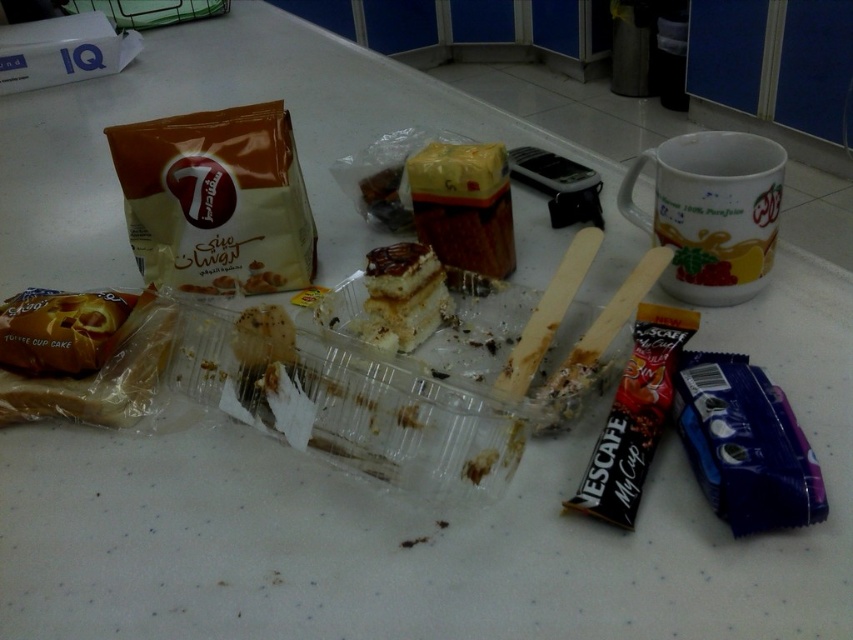
You are a chef trying to place the spongy yellow cake at center into the yellow plastic container at center. Can you fit the cake into the container without moving any other items on the table?

The yellow plastic container at center and spongy yellow cake at center are 3.39 inches apart, so there is enough space between them to fit the cake into the container without moving other items.

You are organizing items on the table and need to place a new item at the exact center of the table. The matte plastic bag at upper left is located at coordinates point 0.311, 0.256. Where should you place the new item to ensure it is centered?

The new item should be placed at the center of the table, which is at coordinates point (426, 320). The matte plastic bag at upper left is at point (218, 198), so moving it to point (426, 320) would center it.

You are organizing items on a table and need to place the matte plastic bag at upper left and the spongy yellow cake at center. Based on their current positions, which item is located more to the left?

The matte plastic bag at upper left is more to the left than the spongy yellow cake at center.